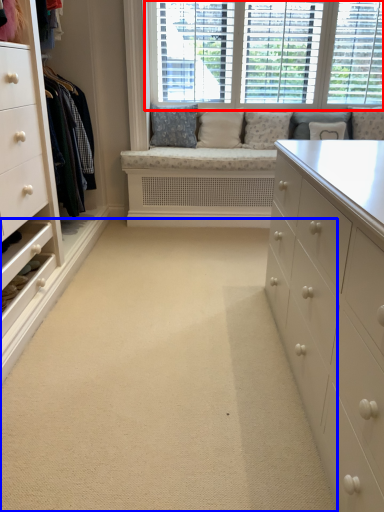
Question: Which of the following is the farthest to the observer, window (highlighted by a red box) or plain (highlighted by a blue box)?

Choices:
 (A) window
 (B) plain

Answer: (A)